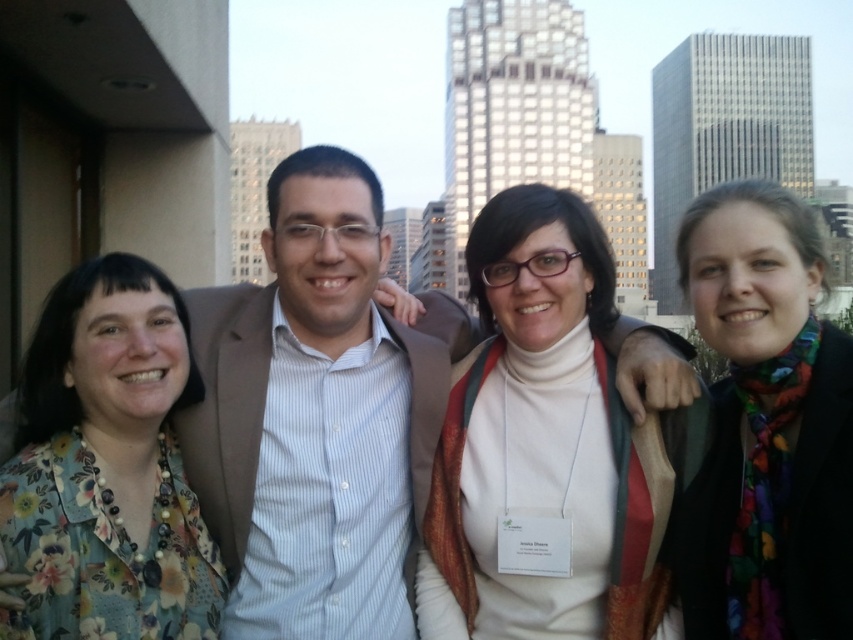
Is white turtleneck sweater at center positioned before multicolored scarf at right?

No, white turtleneck sweater at center is further to the viewer.

Does white turtleneck sweater at center have a greater width compared to multicolored scarf at right?

Indeed, white turtleneck sweater at center has a greater width compared to multicolored scarf at right.

Does point (556, 216) come farther from viewer compared to point (775, 323)?

Yes, it is behind point (775, 323).

You are a GUI agent. You are given a task and a screenshot of the screen. Output one action in this format:
    pyautogui.click(x=<x>, y=<y>)
    Task: Click on the white turtleneck sweater at center
    
    Given the screenshot: What is the action you would take?
    pyautogui.click(x=543, y=440)

How distant is matte brown suit at center from multicolored scarf at right?

matte brown suit at center is 14.17 meters from multicolored scarf at right.

Between matte brown suit at center and multicolored scarf at right, which one has more height?

matte brown suit at center is taller.

Between point (317, 348) and point (706, 234), which one is positioned in front?

Point (706, 234) is more forward.

Locate an element on the screen. The height and width of the screenshot is (640, 853). matte brown suit at center is located at coordinates (306, 378).

Is white turtleneck sweater at center to the right of matte brown suit at center from the viewer's perspective?

Yes, white turtleneck sweater at center is to the right of matte brown suit at center.

Does white turtleneck sweater at center appear on the left side of matte brown suit at center?

In fact, white turtleneck sweater at center is to the right of matte brown suit at center.

You are a GUI agent. You are given a task and a screenshot of the screen. Output one action in this format:
    pyautogui.click(x=<x>, y=<y>)
    Task: Click on the white turtleneck sweater at center
    This screenshot has width=853, height=640.
    Given the screenshot: What is the action you would take?
    pyautogui.click(x=543, y=440)